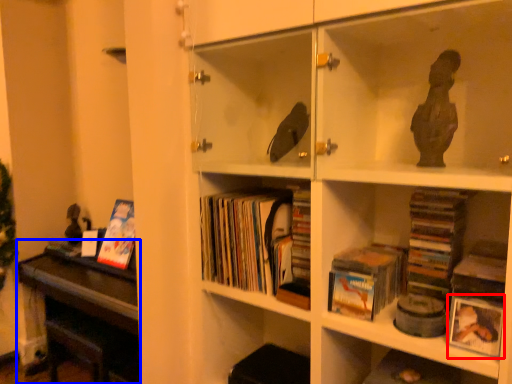
Question: Which of the following is the closest to the observer, paperback book (highlighted by a red box) or table (highlighted by a blue box)?

Choices:
 (A) paperback book
 (B) table

Answer: (A)